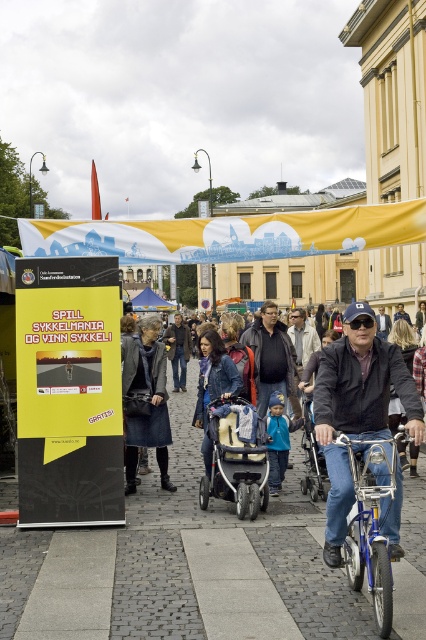
You are organizing a photo shoot and need to place the dark brown leather jacket at center and the blue metallic bicycle at lower right in a way that they don not overlap. Given their sizes, which object should be positioned further back to ensure they fit within the frame?

The dark brown leather jacket at center should be positioned further back because its width is larger than the blue metallic bicycle at lower right, allowing both to fit without overlapping.

You are a photographer trying to capture the perfect shot of the two points in the scene. Which point, point (379, 380) or point (160, 304), will appear larger in your photo?

Point (379, 380) will appear larger in the photo because it is closer to the camera than point (160, 304).

You are a photographer standing at the edge of the scene, wanting to capture a photo of the denim jacket at center without including the promotional stand. Based on the jacket and stand positions, can you position yourself to do this?

The denim jacket at center is positioned at point (x=356, y=408), but without knowing the exact coordinates of the promotional stand, it is impossible to determine if the photographer can position themselves to exclude it from the frame.